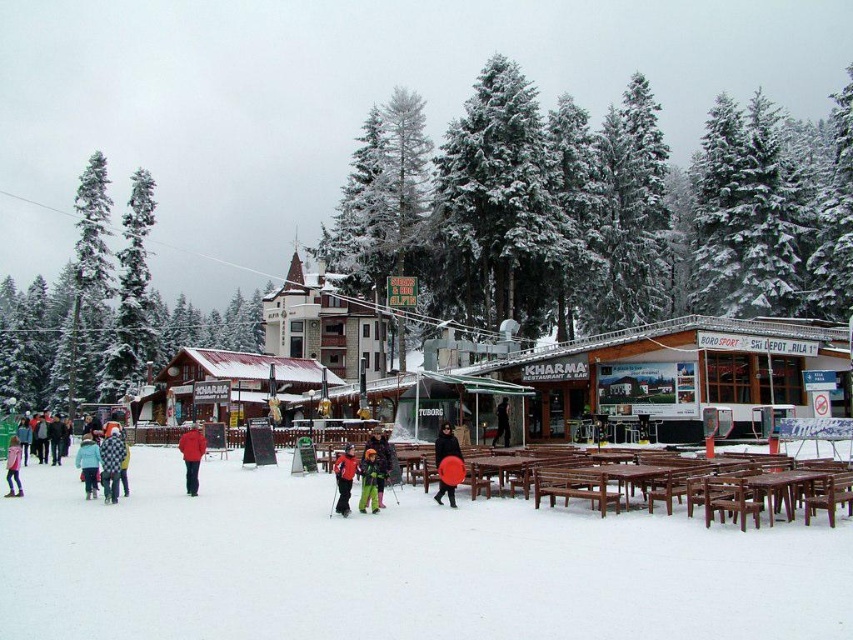
Question: From the image, what is the correct spatial relationship of red matte jacket at center in relation to green matte snow pants at center?

Choices:
 (A) above
 (B) below

Answer: (B)

Question: Can you confirm if green snow-covered tree at left is positioned to the left of matte red sled at center?

Choices:
 (A) yes
 (B) no

Answer: (A)

Question: Among these points, which one is nearest to the camera?

Choices:
 (A) (692, 500)
 (B) (84, 477)

Answer: (A)

Question: Estimate the real-world distances between objects in this image. Which object is farther from the snow-covered evergreen tree at center?

Choices:
 (A) red matte jacket at center
 (B) brown wooden picnic table at lower right
 (C) light blue jacket at lower left

Answer: (C)

Question: Does snow-covered evergreen tree at center have a lesser width compared to green matte snow pants at center?

Choices:
 (A) no
 (B) yes

Answer: (A)

Question: Which object appears closest to the camera in this image?

Choices:
 (A) brown wooden picnic table at lower right
 (B) green snow-covered tree at left
 (C) blue fleece jacket at lower left
 (D) black leather jacket at center

Answer: (A)